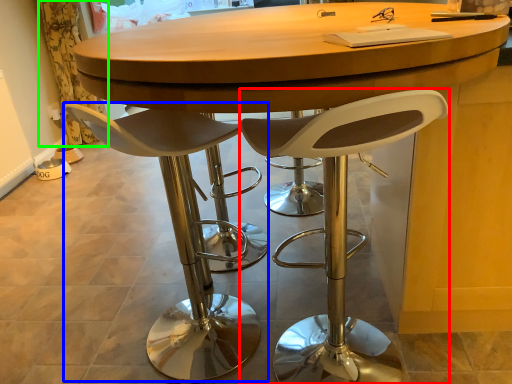
Question: Based on their relative distances, which object is nearer to chair (highlighted by a red box)? Choose from chair (highlighted by a blue box) and curtain (highlighted by a green box).

Choices:
 (A) chair
 (B) curtain

Answer: (A)